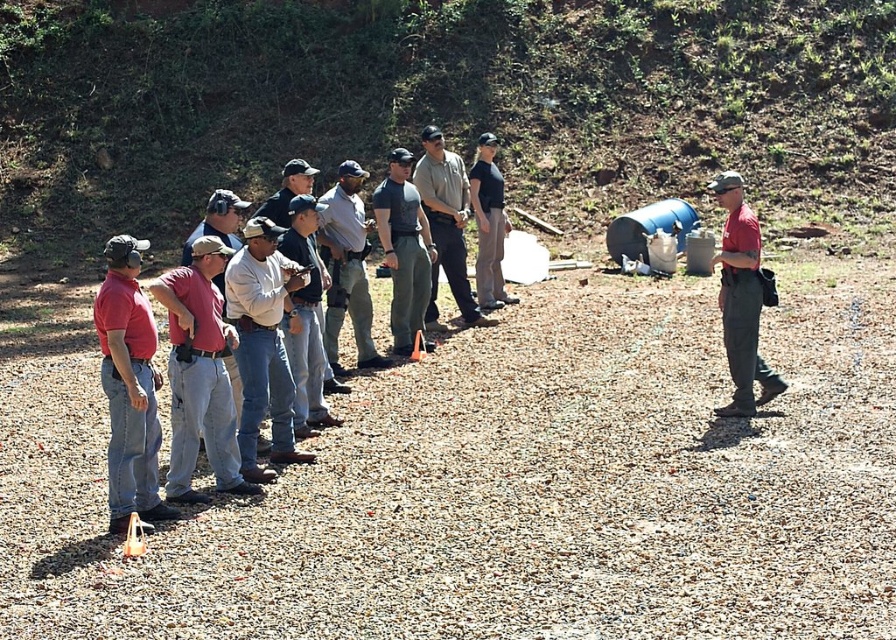
Can you confirm if matte red shirt at left is positioned below black cotton shirt at center?

Indeed, matte red shirt at left is positioned under black cotton shirt at center.

Is matte red shirt at left wider than black cotton shirt at center?

Incorrect, matte red shirt at left's width does not surpass black cotton shirt at center's.

Between point (151, 481) and point (501, 224), which one is positioned in front?

Point (151, 481)

Locate an element on the screen. The width and height of the screenshot is (896, 640). matte red shirt at left is located at coordinates (128, 387).

Describe the element at coordinates (741, 298) in the screenshot. I see `matte red shirt at right` at that location.

Looking at this image, who is higher up, matte red shirt at right or light brown leather jacket at center?

matte red shirt at right is higher up.

Which is in front, point (720, 192) or point (468, 282)?

Point (720, 192)

Find the location of `matte red shirt at right`. matte red shirt at right is located at coordinates (741, 298).

Is denim jeans at center in front of black cotton shirt at center?

Yes, it is in front of black cotton shirt at center.

Which is behind, point (321, 385) or point (483, 204)?

The point (483, 204) is behind.

Between point (309, 417) and point (494, 148), which one is positioned behind?

Positioned behind is point (494, 148).

The width and height of the screenshot is (896, 640). Identify the location of denim jeans at center. (306, 320).